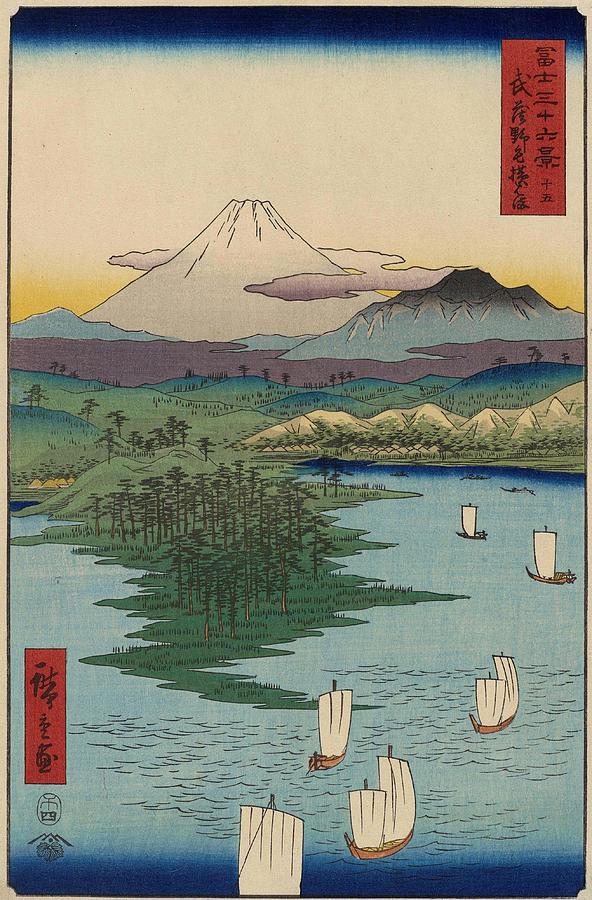
Image resolution: width=592 pixels, height=900 pixels. In order to click on peninsula in this screenshot , I will do `click(189, 653)`.